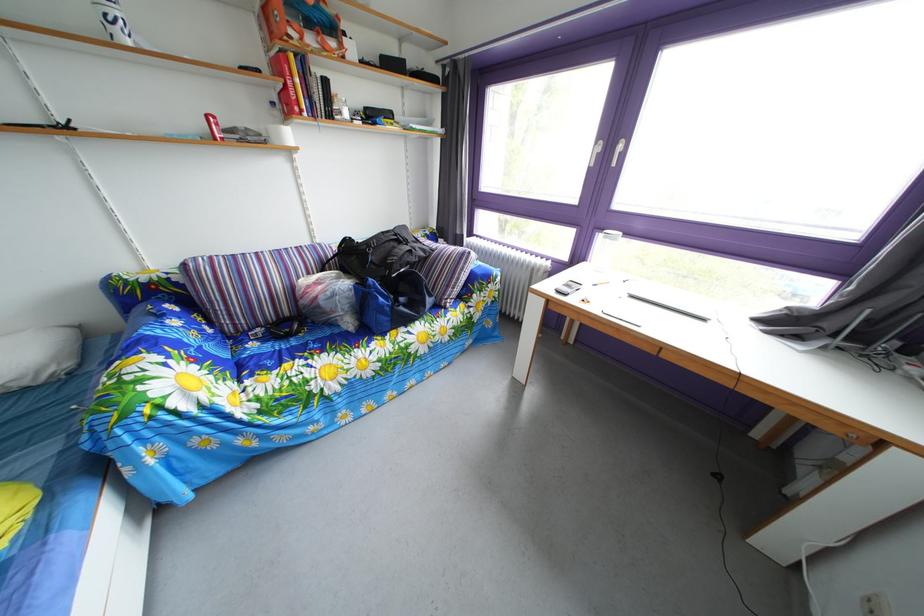
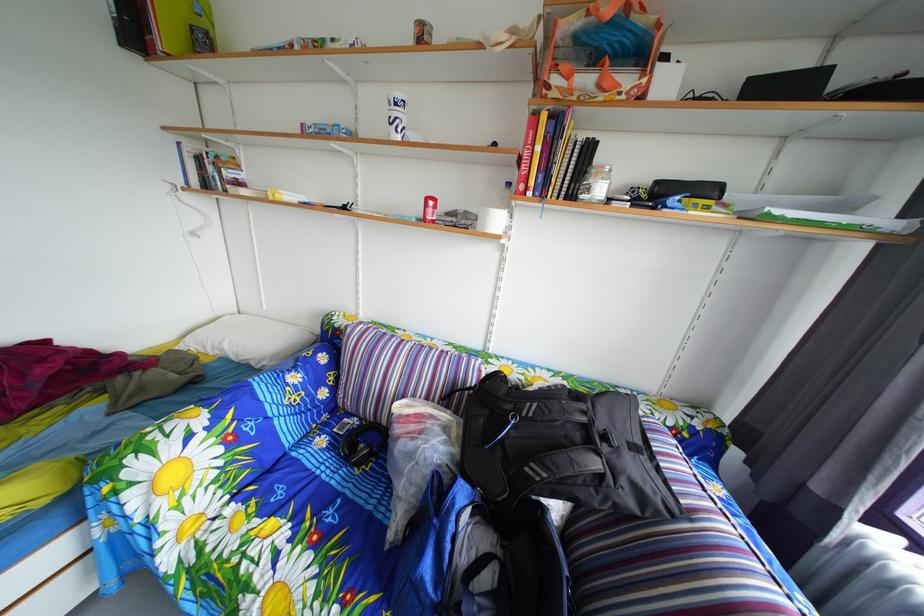
Find the pixel in the second image that matches point 270,338 in the first image.

(367, 428)